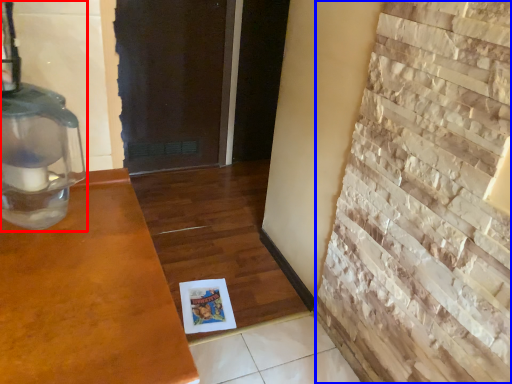
Question: Which of the following is the closest to the observer, oil lamp (highlighted by a red box) or brickwork (highlighted by a blue box)?

Choices:
 (A) oil lamp
 (B) brickwork

Answer: (B)